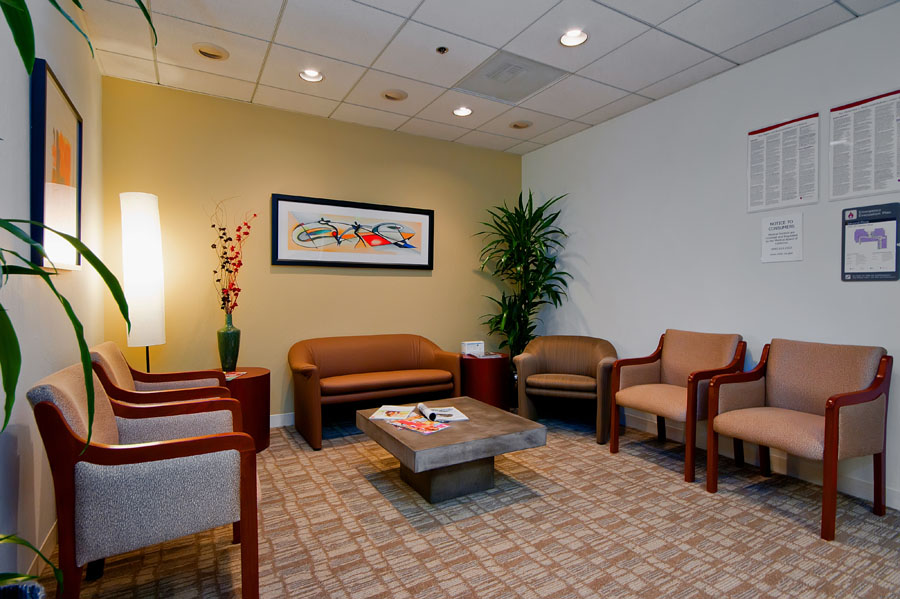
Identify every occurrence of where you'd sit in the image. Your answer should be formatted as a list of tuples, i.e. [(x1, y1), (x2, y2), ...], where each tuple contains the x and y coordinates of a point satisfying the conditions above.

[(666, 395)]